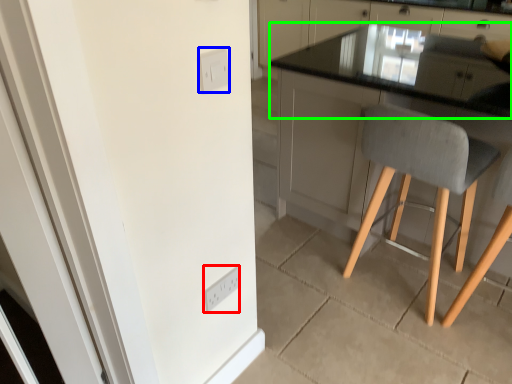
Question: Based on their relative distances, which object is farther from light switch (highlighted by a red box)? Choose from light switch (highlighted by a blue box) and countertop (highlighted by a green box).

Choices:
 (A) light switch
 (B) countertop

Answer: (B)